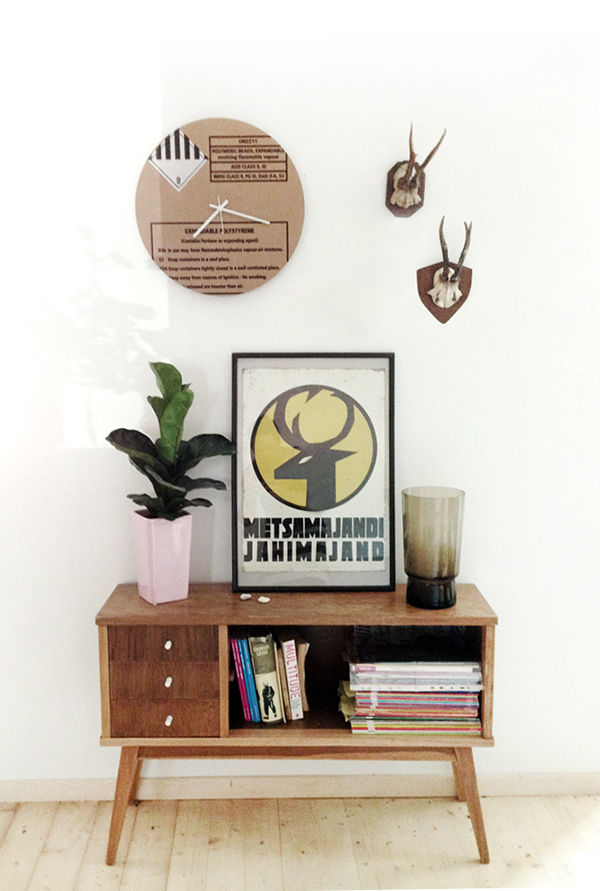
Image resolution: width=600 pixels, height=891 pixels. In order to click on cabinet handles in this screenshot , I will do `click(168, 647)`, `click(169, 681)`, `click(167, 720)`.